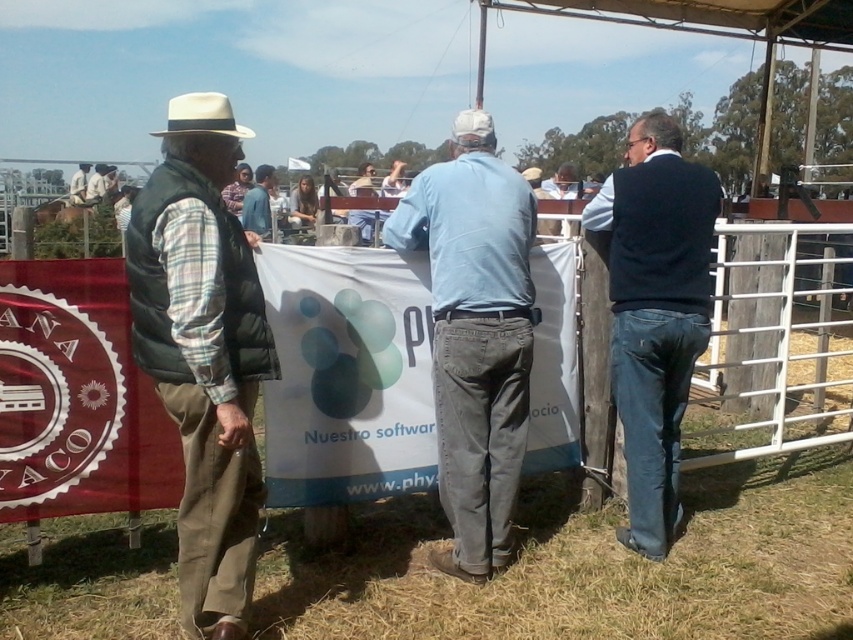
Question: Which of the following is the closest to the observer?

Choices:
 (A) light blue denim jeans at center
 (B) blue denim shirt at center

Answer: (A)

Question: In this image, where is white felt cowboy hat at upper left located relative to blue denim shirt at center?

Choices:
 (A) right
 (B) left

Answer: (B)

Question: Estimate the real-world distances between objects in this image. Which object is closer to the light brown leather vest at left?

Choices:
 (A) white felt cowboy hat at upper left
 (B) blue denim shirt at center

Answer: (B)

Question: Can you confirm if green puffy vest at left is positioned to the right of light blue denim jeans at center?

Choices:
 (A) yes
 (B) no

Answer: (B)

Question: Which object is closer to the camera taking this photo?

Choices:
 (A) white felt cowboy hat at upper left
 (B) green puffy vest at left
 (C) light blue denim jeans at center

Answer: (A)

Question: Does light blue denim jeans at center have a smaller size compared to light brown leather jacket at left?

Choices:
 (A) yes
 (B) no

Answer: (A)